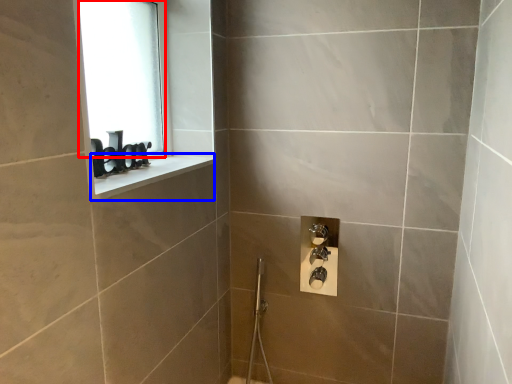
Question: Among these objects, which one is farthest to the camera, window screen (highlighted by a red box) or window sill (highlighted by a blue box)?

Choices:
 (A) window screen
 (B) window sill

Answer: (A)